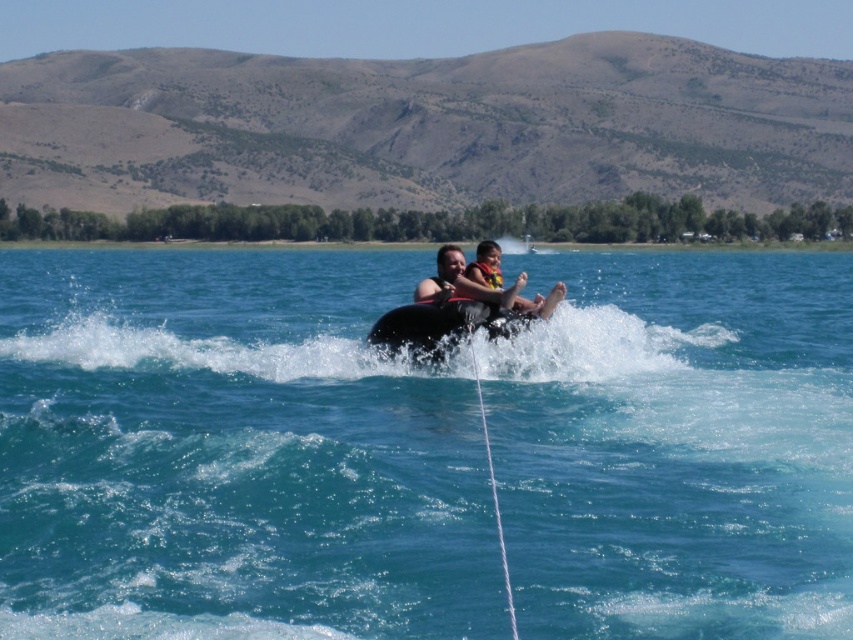
Question: Among these points, which one is farthest from the camera?

Choices:
 (A) (473, 276)
 (B) (486, 285)

Answer: (A)

Question: Can you confirm if matte black life vest at center is positioned above yellow fabric life jacket at center?

Choices:
 (A) yes
 (B) no

Answer: (B)

Question: Does matte black life vest at center appear on the left side of yellow fabric life jacket at center?

Choices:
 (A) yes
 (B) no

Answer: (B)

Question: Does matte black life vest at center have a larger size compared to yellow fabric life jacket at center?

Choices:
 (A) yes
 (B) no

Answer: (A)

Question: Which point is closer to the camera?

Choices:
 (A) clear blue water at center
 (B) matte black life vest at center
 (C) yellow fabric life jacket at center

Answer: (A)

Question: Which object is positioned closest to the clear blue water at center?

Choices:
 (A) yellow fabric life jacket at center
 (B) matte black life vest at center

Answer: (A)